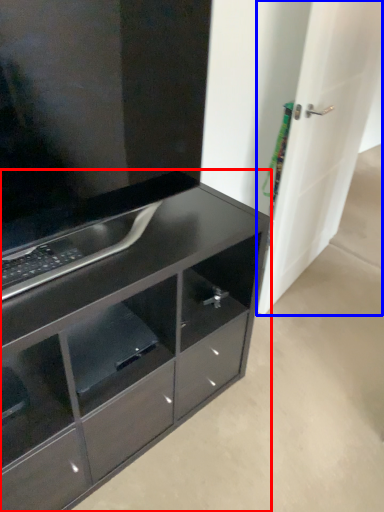
Question: Which of the following is the closest to the observer, chest of drawers (highlighted by a red box) or door (highlighted by a blue box)?

Choices:
 (A) chest of drawers
 (B) door

Answer: (A)